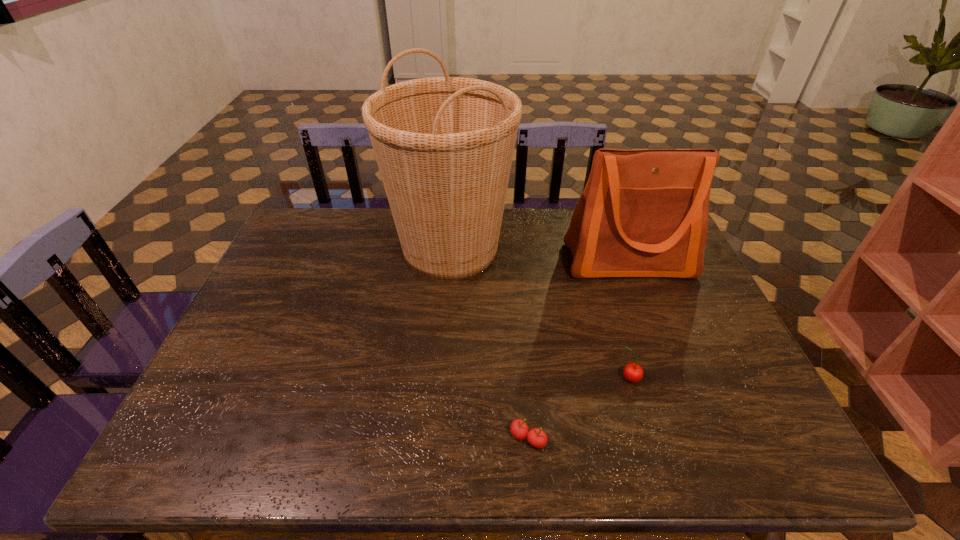
Identify the location of the tallest object. This screenshot has height=540, width=960. (444, 146).

Locate an element on the screen. shopping bag is located at coordinates (643, 213).

Identify the location of the taller cherry. (633, 372).

Identify the location of the farther cherry. The image size is (960, 540). (633, 372).

You are a GUI agent. You are given a task and a screenshot of the screen. Output one action in this format:
    pyautogui.click(x=<x>, y=<y>)
    Task: Click on the left cherry
    
    Given the screenshot: What is the action you would take?
    pyautogui.click(x=536, y=437)

Find the location of `the shortest object`. the shortest object is located at coordinates (536, 437).

This screenshot has height=540, width=960. I want to click on vacant area located on the front of the basket, so click(440, 381).

Where is `vacant area situated 0.190m on the front pocket of the shopping bag`? The width and height of the screenshot is (960, 540). vacant area situated 0.190m on the front pocket of the shopping bag is located at coordinates pos(656,332).

Where is `vacant space located 0.380m on the left of the third farthest object`? This screenshot has width=960, height=540. vacant space located 0.380m on the left of the third farthest object is located at coordinates (463, 379).

Where is `free space located on the left of the shortest object`? The image size is (960, 540). free space located on the left of the shortest object is located at coordinates (404, 438).